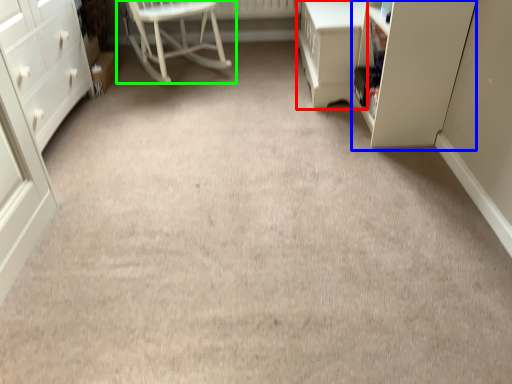
Question: Estimate the real-world distances between objects in this image. Which object is farther from vanity (highlighted by a red box), cabinetry (highlighted by a blue box) or chair (highlighted by a green box)?

Choices:
 (A) cabinetry
 (B) chair

Answer: (B)